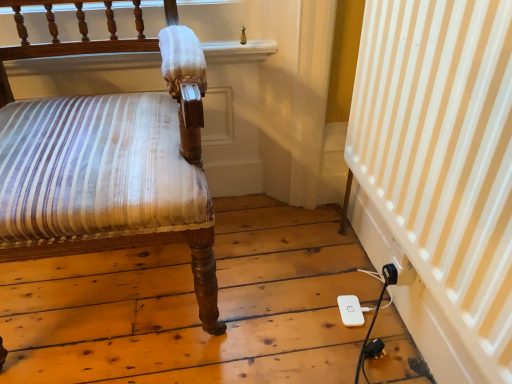
Question: Considering the relative sizes of matte brown wood chair at left and white striped curtain at lower right in the image provided, is matte brown wood chair at left taller than white striped curtain at lower right?

Choices:
 (A) no
 (B) yes

Answer: (B)

Question: Can you confirm if matte brown wood chair at left is wider than white striped curtain at lower right?

Choices:
 (A) no
 (B) yes

Answer: (B)

Question: Is there a large distance between matte brown wood chair at left and white striped curtain at lower right?

Choices:
 (A) no
 (B) yes

Answer: (A)

Question: Is matte brown wood chair at left looking in the opposite direction of white striped curtain at lower right?

Choices:
 (A) yes
 (B) no

Answer: (B)

Question: Can you confirm if matte brown wood chair at left is positioned to the left of white striped curtain at lower right?

Choices:
 (A) no
 (B) yes

Answer: (B)

Question: Visually, is matte brown wood chair at left positioned to the left or to the right of white striped curtain at lower right?

Choices:
 (A) right
 (B) left

Answer: (B)

Question: From the image's perspective, is matte brown wood chair at left positioned above or below white striped curtain at lower right?

Choices:
 (A) below
 (B) above

Answer: (B)

Question: Would you say matte brown wood chair at left is inside or outside white striped curtain at lower right?

Choices:
 (A) inside
 (B) outside

Answer: (B)

Question: Looking at their shapes, would you say matte brown wood chair at left is wider or thinner than white striped curtain at lower right?

Choices:
 (A) wide
 (B) thin

Answer: (A)

Question: From a real-world perspective, is white striped curtain at lower right positioned above or below white plastic ipod at lower right?

Choices:
 (A) below
 (B) above

Answer: (B)

Question: Would you say white striped curtain at lower right is inside or outside white plastic ipod at lower right?

Choices:
 (A) inside
 (B) outside

Answer: (B)

Question: In terms of size, does white striped curtain at lower right appear bigger or smaller than white plastic ipod at lower right?

Choices:
 (A) big
 (B) small

Answer: (A)

Question: Is point (450, 100) positioned closer to the camera than point (355, 317)?

Choices:
 (A) farther
 (B) closer

Answer: (B)

Question: Considering the relative positions of white striped curtain at lower right and matte brown wood chair at left in the image provided, is white striped curtain at lower right to the left or to the right of matte brown wood chair at left?

Choices:
 (A) left
 (B) right

Answer: (B)

Question: From the image's perspective, is white striped curtain at lower right positioned above or below matte brown wood chair at left?

Choices:
 (A) above
 (B) below

Answer: (B)